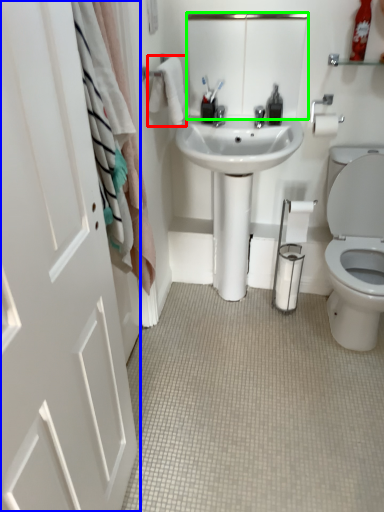
Question: Based on their relative distances, which object is farther from bath towel (highlighted by a red box)? Choose from door (highlighted by a blue box) and mirror (highlighted by a green box).

Choices:
 (A) door
 (B) mirror

Answer: (A)